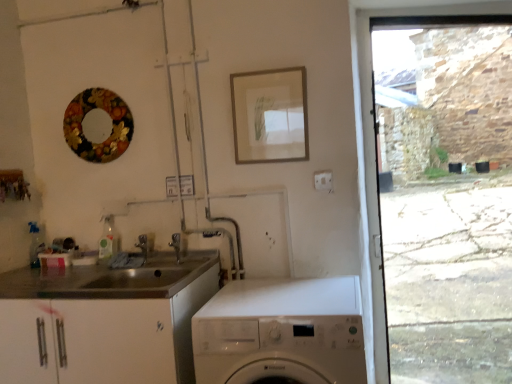
Where is `white glossy washing machine at lower center`? Image resolution: width=512 pixels, height=384 pixels. white glossy washing machine at lower center is located at coordinates (281, 332).

Image resolution: width=512 pixels, height=384 pixels. I want to click on silver metallic tap at center, which appears as the first tap when viewed from the left, so click(143, 245).

I want to click on metallic silver faucet at upper center, the 2th tap in the back-to-front sequence, so click(176, 245).

Is silver metallic tap at center, placed as the 2th tap when sorted from front to back, placed right next to metallic floral wreath at upper left?

No, silver metallic tap at center, placed as the 2th tap when sorted from front to back, is not next to metallic floral wreath at upper left.

Looking at this image, how much distance is there between silver metallic tap at center, placed as the 2th tap when sorted from front to back, and metallic floral wreath at upper left?

silver metallic tap at center, placed as the 2th tap when sorted from front to back, is 58.64 centimeters from metallic floral wreath at upper left.

Is silver metallic tap at center, placed as the 2th tap when sorted from front to back, oriented towards metallic floral wreath at upper left?

No, silver metallic tap at center, placed as the 2th tap when sorted from front to back, is not turned towards metallic floral wreath at upper left.

Relative to metallic floral wreath at upper left, is silver metallic tap at center, which ranks as the second tap in right-to-left order, in front or behind?

Visually, silver metallic tap at center, which ranks as the second tap in right-to-left order, is located in front of metallic floral wreath at upper left.

Looking at this image, is white glossy washing machine at lower center not inside metallic floral wreath at upper left?

white glossy washing machine at lower center lies outside metallic floral wreath at upper left's area.

Considering the sizes of objects white glossy washing machine at lower center and metallic floral wreath at upper left in the image provided, who is bigger, white glossy washing machine at lower center or metallic floral wreath at upper left?

Bigger between the two is white glossy washing machine at lower center.

Identify the location of washing machine below the metallic floral wreath at upper left (from a real-world perspective). The image size is (512, 384). (281, 332).

Is white glossy washing machine at lower center not close to metallic floral wreath at upper left?

Yes, white glossy washing machine at lower center and metallic floral wreath at upper left are located far from each other.

Can you confirm if metallic silver faucet at upper center, the 2th tap in the back-to-front sequence, is smaller than silver metallic tap at center, which ranks as the second tap in right-to-left order?

Indeed, metallic silver faucet at upper center, the 2th tap in the back-to-front sequence, has a smaller size compared to silver metallic tap at center, which ranks as the second tap in right-to-left order.

From a real-world perspective, between metallic silver faucet at upper center, positioned as the first tap in front-to-back order, and silver metallic tap at center, which appears as the first tap when viewed from the back, who is vertically lower?

metallic silver faucet at upper center, positioned as the first tap in front-to-back order, is physically lower.

Is metallic silver faucet at upper center, the 2th tap in the back-to-front sequence, aimed at silver metallic tap at center, placed as the 2th tap when sorted from front to back?

No, metallic silver faucet at upper center, the 2th tap in the back-to-front sequence, is not aimed at silver metallic tap at center, placed as the 2th tap when sorted from front to back.

Is metallic silver faucet at upper center, positioned as the first tap in front-to-back order, with silver metallic tap at center, placed as the 2th tap when sorted from front to back?

No, metallic silver faucet at upper center, positioned as the first tap in front-to-back order, is not with silver metallic tap at center, placed as the 2th tap when sorted from front to back.

From the image's perspective, would you say wooden frame at upper center is shown under silver metallic tap at center, placed as the 2th tap when sorted from front to back?

No.

Is point (255, 161) closer or farther from the camera than point (135, 245)?

Point (255, 161).

Is wooden frame at upper center beside silver metallic tap at center, placed as the 2th tap when sorted from front to back?

No, wooden frame at upper center is not beside silver metallic tap at center, placed as the 2th tap when sorted from front to back.

Considering the sizes of wooden frame at upper center and silver metallic tap at center, placed as the 2th tap when sorted from front to back, in the image, is wooden frame at upper center bigger or smaller than silver metallic tap at center, placed as the 2th tap when sorted from front to back,?

wooden frame at upper center is bigger than silver metallic tap at center, placed as the 2th tap when sorted from front to back.

Where is `the 1st tap below the wooden frame at upper center (from the image's perspective)`? The height and width of the screenshot is (384, 512). the 1st tap below the wooden frame at upper center (from the image's perspective) is located at coordinates (176, 245).

Is metallic silver faucet at upper center, the 2th tap in the back-to-front sequence, positioned with its back to wooden frame at upper center?

No, metallic silver faucet at upper center, the 2th tap in the back-to-front sequence,'s orientation is not away from wooden frame at upper center.

Does point (172, 235) lie behind point (252, 83)?

Yes, it is.

There is a wooden frame at upper center. Where is `the 1st tap below it (from a real-world perspective)`? This screenshot has height=384, width=512. the 1st tap below it (from a real-world perspective) is located at coordinates (143, 245).

Who is smaller, silver metallic tap at center, which appears as the first tap when viewed from the back, or wooden frame at upper center?

silver metallic tap at center, which appears as the first tap when viewed from the back.

Is there a large distance between silver metallic tap at center, which appears as the first tap when viewed from the left, and wooden frame at upper center?

Actually, silver metallic tap at center, which appears as the first tap when viewed from the left, and wooden frame at upper center are a little close together.

In terms of width, does metallic silver faucet at upper center, the second tap positioned from the left, look wider or thinner when compared to metallic floral wreath at upper left?

Clearly, metallic silver faucet at upper center, the second tap positioned from the left, has less width compared to metallic floral wreath at upper left.

From the picture: Is metallic silver faucet at upper center, positioned as the first tap in front-to-back order, located outside metallic floral wreath at upper left?

That's correct, metallic silver faucet at upper center, positioned as the first tap in front-to-back order, is outside of metallic floral wreath at upper left.

Is point (179, 251) closer or farther from the camera than point (99, 151)?

Point (179, 251).

Locate an element on the screen. mirror behind the silver metallic tap at center, which ranks as the second tap in right-to-left order is located at coordinates (98, 125).

Where is `mirror positioned vertically above the white glossy washing machine at lower center (from a real-world perspective)`? The image size is (512, 384). mirror positioned vertically above the white glossy washing machine at lower center (from a real-world perspective) is located at coordinates tap(98, 125).

From the image, which object appears to be farther from silver metallic tap at center, which ranks as the second tap in right-to-left order, metallic floral wreath at upper left or white glossy washing machine at lower center?

white glossy washing machine at lower center is positioned further to the anchor silver metallic tap at center, which ranks as the second tap in right-to-left order.

Considering their positions, is metallic floral wreath at upper left positioned closer to wooden frame at upper center than metallic silver faucet at upper center, which is the first tap in right-to-left order?

metallic floral wreath at upper left.

From the image, which object appears to be farther from silver metallic tap at center, which appears as the first tap when viewed from the back, metallic silver faucet at upper center, the second tap positioned from the left, or white glossy washing machine at lower center?

Based on the image, white glossy washing machine at lower center appears to be further to silver metallic tap at center, which appears as the first tap when viewed from the back.

Looking at the image, which one is located further to metallic floral wreath at upper left, silver metallic tap at center, which appears as the first tap when viewed from the back, or metallic silver faucet at upper center, the second tap positioned from the left?

Based on the image, metallic silver faucet at upper center, the second tap positioned from the left, appears to be further to metallic floral wreath at upper left.

Considering their positions, is silver metallic tap at center, which appears as the first tap when viewed from the left, positioned further to wooden frame at upper center than metallic floral wreath at upper left?

silver metallic tap at center, which appears as the first tap when viewed from the left, lies further to wooden frame at upper center than the other object.

Which object lies further to the anchor point wooden frame at upper center, silver metallic tap at center, which ranks as the second tap in right-to-left order, or metallic silver faucet at upper center, which is the first tap in right-to-left order?

silver metallic tap at center, which ranks as the second tap in right-to-left order, lies further to wooden frame at upper center than the other object.

When comparing their distances from wooden frame at upper center, does white glossy washing machine at lower center or metallic floral wreath at upper left seem closer?

metallic floral wreath at upper left is positioned closer to the anchor wooden frame at upper center.

Looking at this image, based on their spatial positions, is silver metallic tap at center, placed as the 2th tap when sorted from front to back, or wooden frame at upper center further from metallic floral wreath at upper left?

wooden frame at upper center is positioned further to the anchor metallic floral wreath at upper left.

Where is `tap between white glossy washing machine at lower center and silver metallic tap at center, placed as the 2th tap when sorted from front to back, along the z-axis`? tap between white glossy washing machine at lower center and silver metallic tap at center, placed as the 2th tap when sorted from front to back, along the z-axis is located at coordinates (176, 245).

Image resolution: width=512 pixels, height=384 pixels. I want to click on mirror between wooden frame at upper center and white glossy washing machine at lower center from top to bottom, so (x=98, y=125).

Locate an element on the screen. This screenshot has width=512, height=384. tap between wooden frame at upper center and silver metallic tap at center, which appears as the first tap when viewed from the left, vertically is located at coordinates (176, 245).

Where is `tap between metallic floral wreath at upper left and silver metallic tap at center, which ranks as the second tap in right-to-left order, vertically`? This screenshot has height=384, width=512. tap between metallic floral wreath at upper left and silver metallic tap at center, which ranks as the second tap in right-to-left order, vertically is located at coordinates (176, 245).